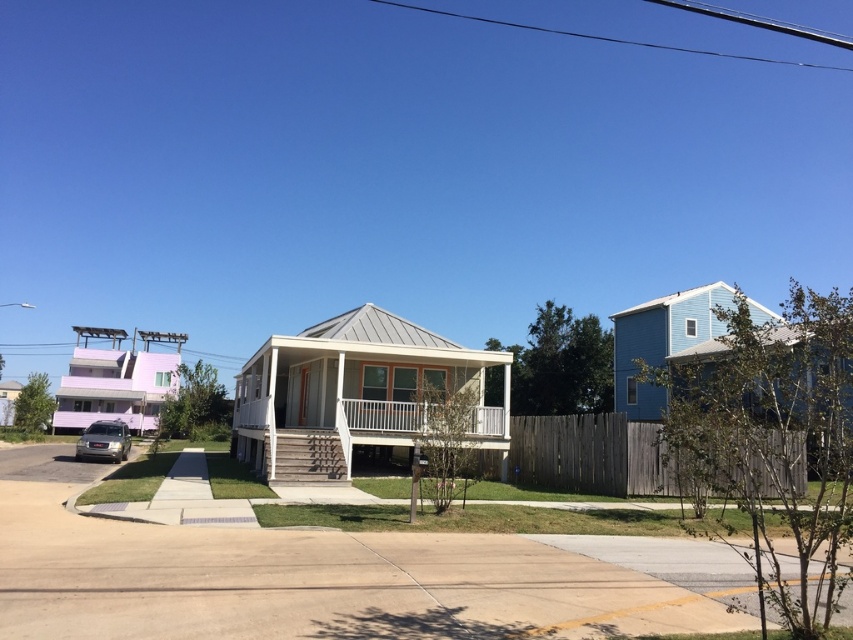
Find the location of `white metal porch at center`. white metal porch at center is located at coordinates (383, 416).

In the scene shown: Can you confirm if white metal porch at center is smaller than satin silver suv at lower left?

Yes, white metal porch at center is smaller than satin silver suv at lower left.

The height and width of the screenshot is (640, 853). Describe the element at coordinates (383, 416) in the screenshot. I see `white metal porch at center` at that location.

The image size is (853, 640). I want to click on white metal porch at center, so point(383,416).